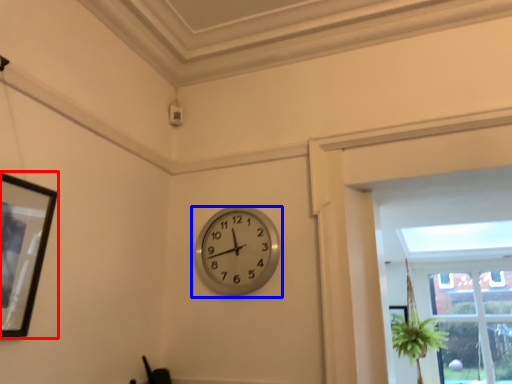
Question: Which object appears farthest to the camera in this image, picture frame (highlighted by a red box) or wall clock (highlighted by a blue box)?

Choices:
 (A) picture frame
 (B) wall clock

Answer: (B)